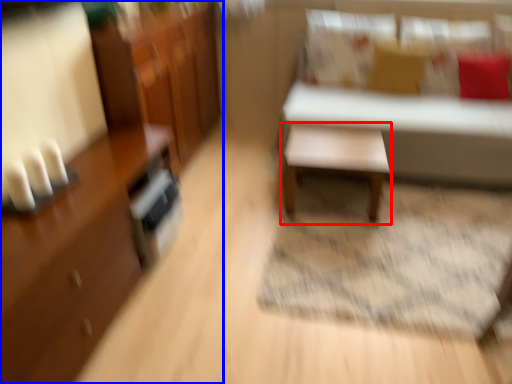
Question: Among these objects, which one is farthest to the camera, table (highlighted by a red box) or cabinetry (highlighted by a blue box)?

Choices:
 (A) table
 (B) cabinetry

Answer: (A)